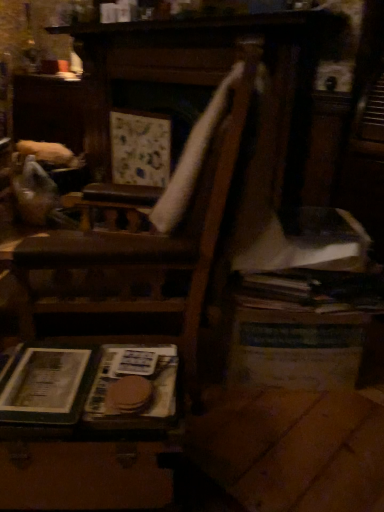
You are a GUI agent. You are given a task and a screenshot of the screen. Output one action in this format:
    pyautogui.click(x=<x>, y=<y>)
    Task: Click on the vacant area that lies to the right of wooden suitcase at lower left, which is counted as the 1th table, starting from the left
    The height and width of the screenshot is (512, 384).
    Given the screenshot: What is the action you would take?
    pyautogui.click(x=243, y=447)